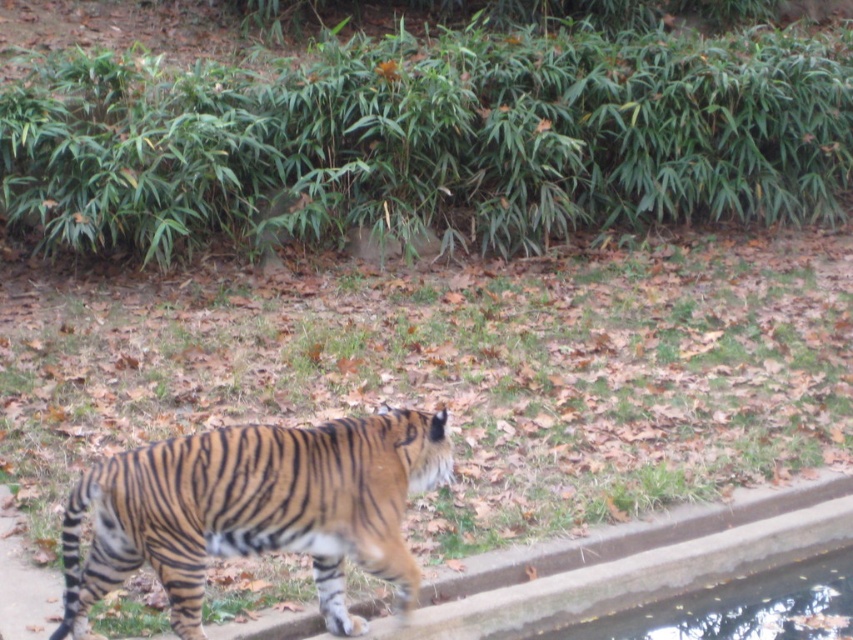
Question: Among these points, which one is farthest from the camera?

Choices:
 (A) (727, 616)
 (B) (131, 467)

Answer: (A)

Question: Where is orange-brown striped tiger at center located in relation to clear concrete edge at lower right in the image?

Choices:
 (A) below
 (B) above

Answer: (B)

Question: Can you confirm if orange-brown striped tiger at center is smaller than clear concrete edge at lower right?

Choices:
 (A) yes
 (B) no

Answer: (B)

Question: Is orange-brown striped tiger at center positioned behind clear concrete edge at lower right?

Choices:
 (A) no
 (B) yes

Answer: (A)

Question: Which point is closer to the camera?

Choices:
 (A) orange-brown striped tiger at center
 (B) clear concrete edge at lower right

Answer: (A)